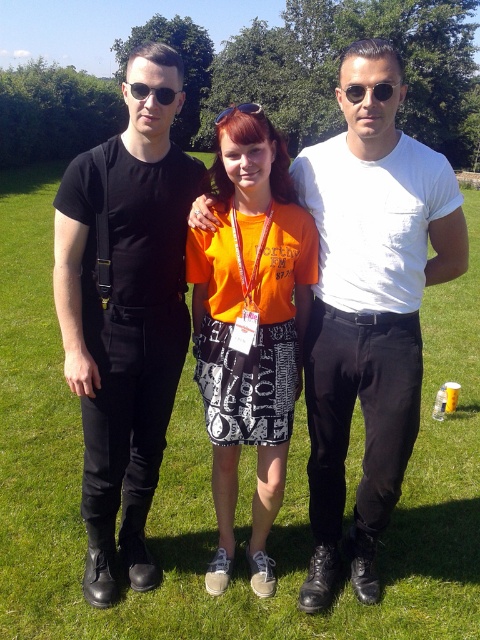
Question: Which is farther from the orange cotton t-shirt at center?

Choices:
 (A) black matte/black pants at left
 (B) black plastic sunglasses at center
 (C) white matte t-shirt at center

Answer: (B)

Question: Is the position of black plastic sunglasses at center more distant than that of blue reflective sunglasses at center?

Choices:
 (A) yes
 (B) no

Answer: (B)

Question: Is white matte t-shirt at center in front of orange cotton t-shirt at center?

Choices:
 (A) yes
 (B) no

Answer: (B)

Question: Which point is closer to the camera?

Choices:
 (A) black plastic sunglasses at center
 (B) white matte t-shirt at center
 (C) orange cotton t-shirt at center

Answer: (A)

Question: Which of the following is the farthest from the observer?

Choices:
 (A) orange cotton t-shirt at center
 (B) black matte/black pants at left
 (C) blue reflective sunglasses at center
 (D) white matte t-shirt at center

Answer: (D)

Question: Can you confirm if white matte t-shirt at center is wider than black matte/black pants at left?

Choices:
 (A) no
 (B) yes

Answer: (A)